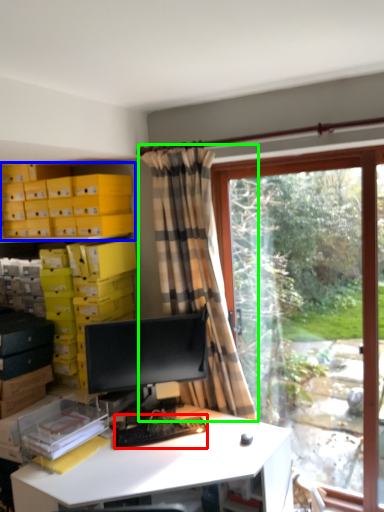
Question: Which object is the farthest from computer keyboard (highlighted by a red box)? Choose among these: shelf (highlighted by a blue box) or curtain (highlighted by a green box).

Choices:
 (A) shelf
 (B) curtain

Answer: (A)